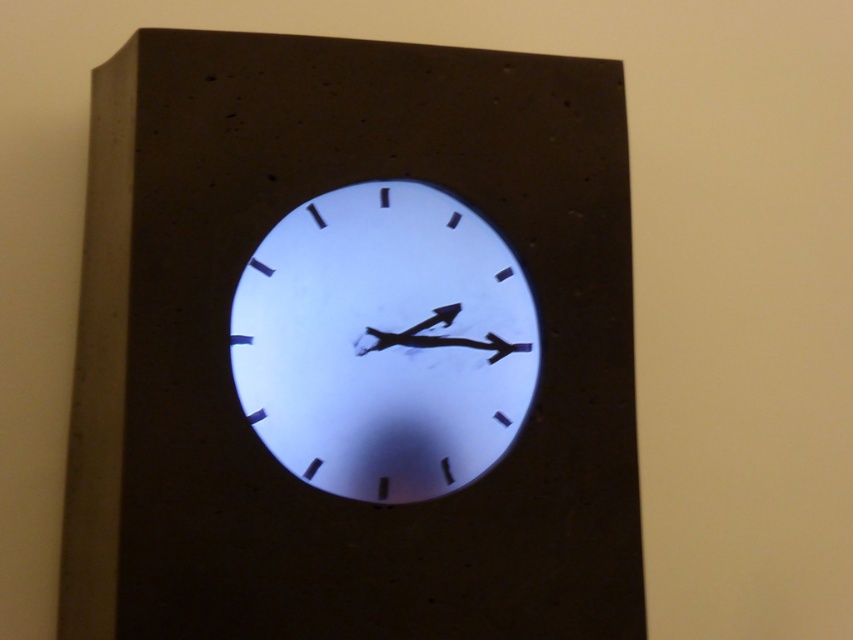
Question: Can you confirm if white matte clock at center is positioned to the right of white glossy clock at center?

Choices:
 (A) no
 (B) yes

Answer: (A)

Question: Among these points, which one is nearest to the camera?

Choices:
 (A) (364, 467)
 (B) (553, 122)

Answer: (A)

Question: Does white matte clock at center have a greater width compared to white glossy clock at center?

Choices:
 (A) yes
 (B) no

Answer: (A)

Question: Can you confirm if white matte clock at center is positioned below white glossy clock at center?

Choices:
 (A) yes
 (B) no

Answer: (A)